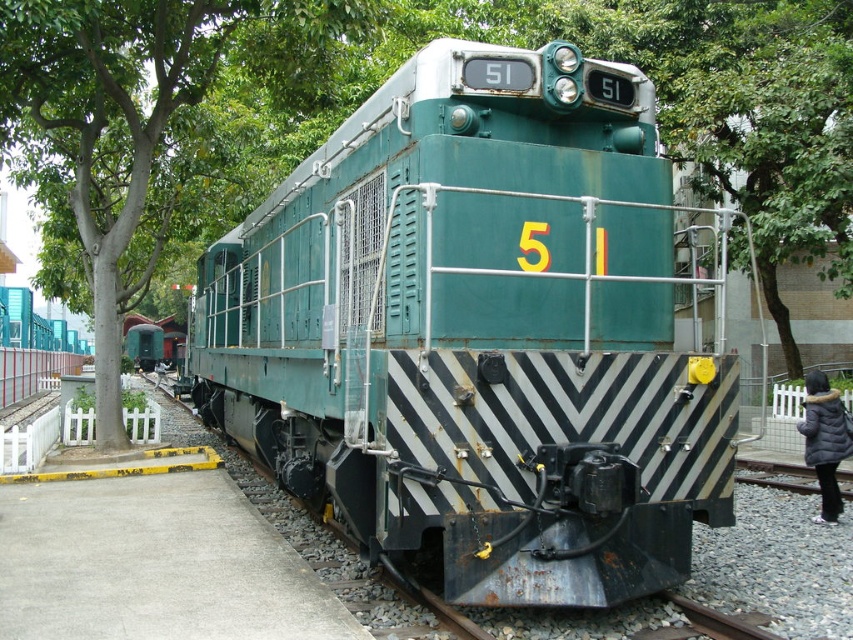
Question: Based on their relative distances, which object is nearer to the dark gray down jacket at lower right?

Choices:
 (A) green leafy tree at center
 (B) black leather jacket at center
 (C) green matte train at center

Answer: (C)

Question: Can you confirm if green leafy tree at center is wider than black leather jacket at center?

Choices:
 (A) yes
 (B) no

Answer: (A)

Question: Can you confirm if dark gray down jacket at lower right is smaller than black leather jacket at center?

Choices:
 (A) yes
 (B) no

Answer: (A)

Question: Does green leafy tree at center appear on the left side of black leather jacket at center?

Choices:
 (A) no
 (B) yes

Answer: (A)

Question: Among these objects, which one is nearest to the camera?

Choices:
 (A) black leather jacket at center
 (B) green matte train at center
 (C) green leafy tree at center
 (D) dark gray down jacket at lower right

Answer: (B)

Question: Which of the following is the farthest from the observer?

Choices:
 (A) green leafy tree at center
 (B) green matte train at center
 (C) black leather jacket at center
 (D) dark gray down jacket at lower right

Answer: (C)